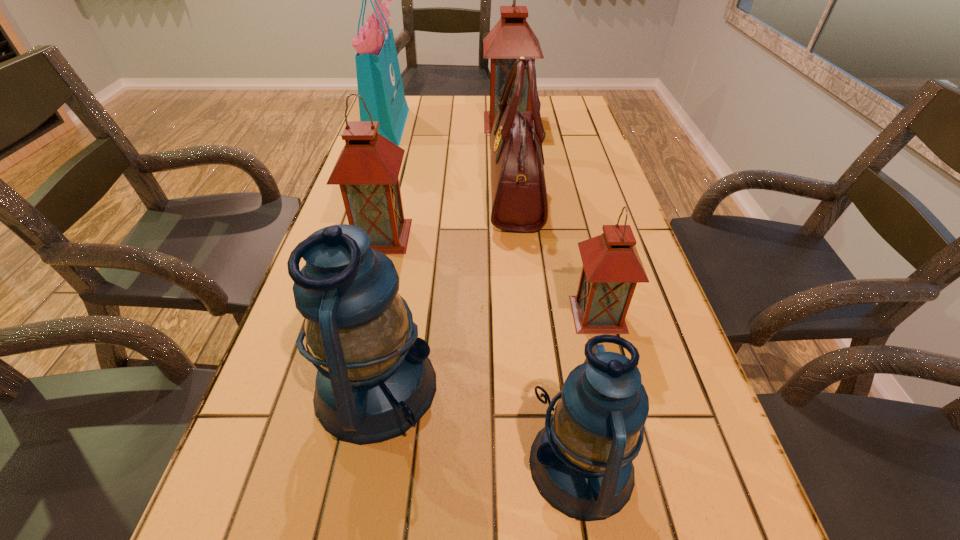
Identify the location of unoccupied area between the nearest pink lantern and the biggest pink lantern. The image size is (960, 540). (553, 218).

Identify the location of vacant space in between the second farthest lantern and the right blue lantern. The width and height of the screenshot is (960, 540). (481, 350).

Identify the location of vacant space that's between the smaller blue lantern and the bigger blue lantern. (479, 426).

Image resolution: width=960 pixels, height=540 pixels. What are the coordinates of `free spot between the tallest lantern and the smallest pink lantern` in the screenshot? It's located at [x=553, y=218].

I want to click on the fourth closest object to the brown handbag, so click(x=379, y=81).

Choose which object is the second nearest neighbor to the bigger blue lantern. Please provide its 2D coordinates. Your answer should be formatted as a tuple, i.e. [(x, y)], where the tuple contains the x and y coordinates of a point satisfying the conditions above.

[(367, 170)]

I want to click on lantern that is the fourth closest to the brown handbag, so click(374, 381).

Identify the location of lantern object that ranks as the closest to the leftmost pink lantern. (374, 381).

Locate which pink lantern is the second closest to the second smallest pink lantern. Please provide its 2D coordinates. Your answer should be formatted as a tuple, i.e. [(x, y)], where the tuple contains the x and y coordinates of a point satisfying the conditions above.

[(512, 37)]

This screenshot has height=540, width=960. In order to click on pink lantern object that ranks as the closest to the bigger blue lantern in this screenshot , I will do `click(367, 170)`.